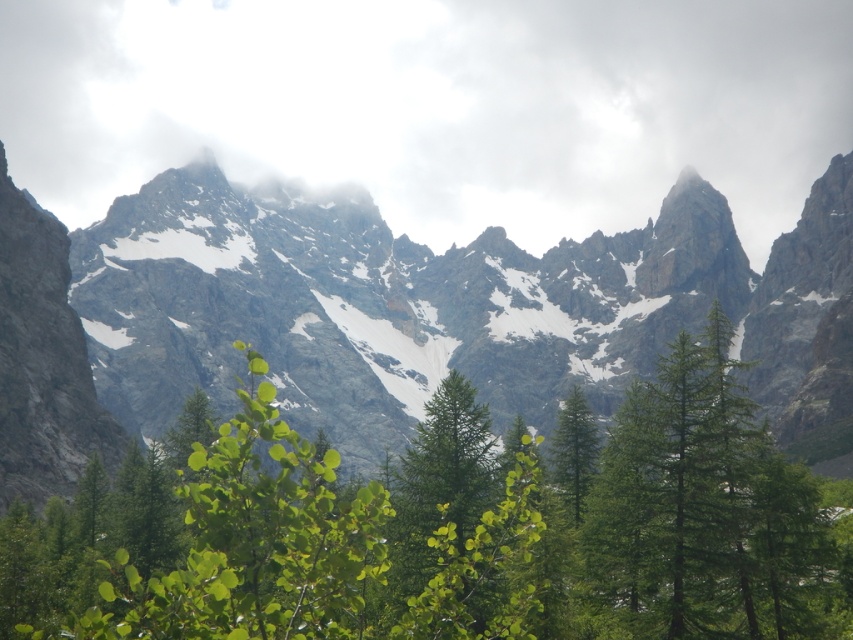
In the scene shown: You are a hiker standing at the edge of the mountain path and see the green leafy tree at center and the green matte tree at center. Which tree would you need to look up more to see the top of?

The green leafy tree at center is much taller than the green matte tree at center, so you would need to look up more to see the top of the green leafy tree at center.

From the picture: You are a hiker planning to take a photo of the rocky gray mountain range at center and the green matte tree at center from a viewpoint. Which object should you position to your right side to ensure both are in the frame?

You should position the green matte tree at center to your right side because the rocky gray mountain range at center is to the left of it, so placing the tree to your right will keep both in the frame.

You are an environmental scientist observing the mountainous landscape. You notice the rocky gray mountain range at center and the green matte tree at center. Based on their positions, which one is closer to you?

The rocky gray mountain range at center is closer to you because it is positioned in front of the green matte tree at center.